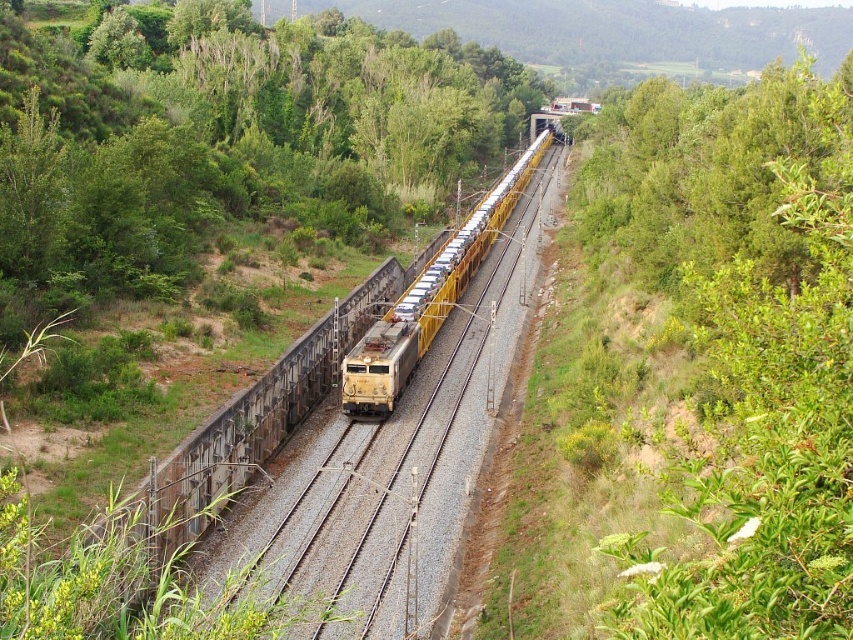
You are a railway inspector checking the layout of the tracks. You notice the yellow metal train tracks at center and the yellow metallic train at center. Which one takes up more space in the image?

The yellow metallic train at center takes up more space than the yellow metal train tracks at center.

You are an observer standing on the platform watching the yellow metallic train at center and the yellow metallic locomotive at center pass by. Which one passes by first?

The yellow metallic locomotive at center passes by first because it is positioned to the left of the yellow metallic train at center, and since the train is moving forward, the locomotive leads the way.